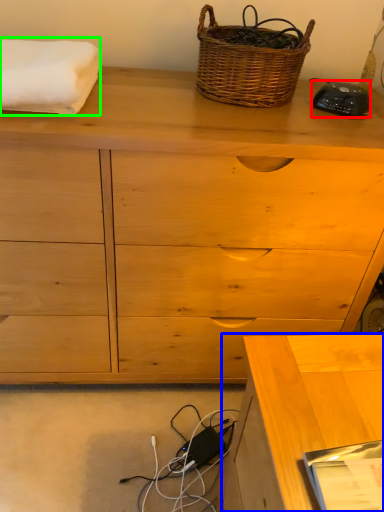
Question: Which object is positioned closest to gadget (highlighted by a red box)? Select from desk (highlighted by a blue box) and bath towel (highlighted by a green box).

Choices:
 (A) desk
 (B) bath towel

Answer: (B)